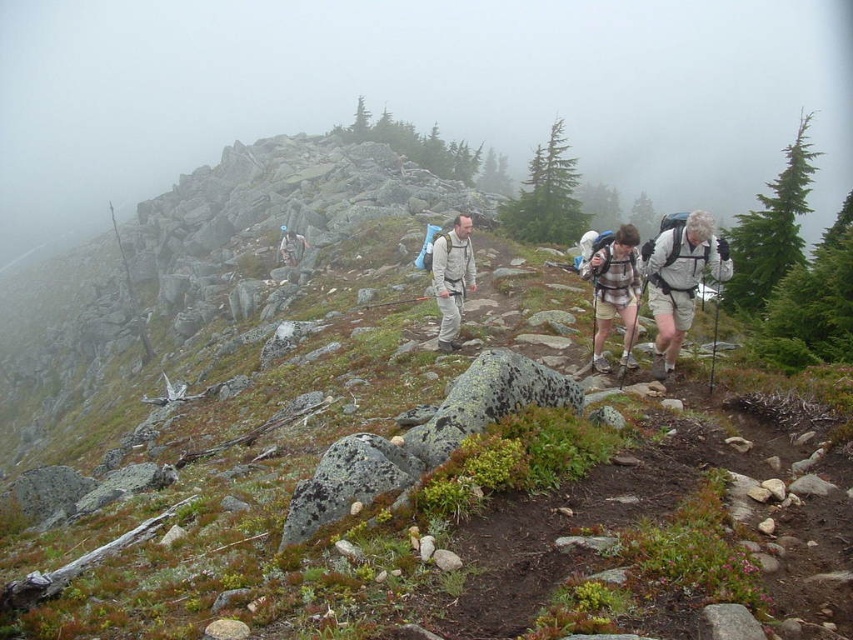
Consider the image. You are one of the hikers and you need to locate your white matte backpack at right and matte gray backpack at center. Based on the scene, which backpack is positioned further to the right side of the image?

The white matte backpack at right is positioned to the right of the matte gray backpack at center, so the white matte backpack at right is further to the right side of the image.

You are a hiker trying to navigate the rocky mountain trail. You see two points marked on your map at coordinates point [627,330] and point [457,253]. Which point should you head towards first if you want to follow the trail in the correct direction?

You should head towards point [627,330] first because it is in front of point [457,253] along the trail.

You are one of the hikers and you want to hand a water bottle from your white matte backpack at right to the hiker carrying the matte gray backpack at center. Which backpack is physically nearer to you?

The white matte backpack at right is closer to the viewer than the matte gray backpack at center, so you can easily hand the water bottle from your white matte backpack at right to the hiker with the matte gray backpack at center since it is farther away.